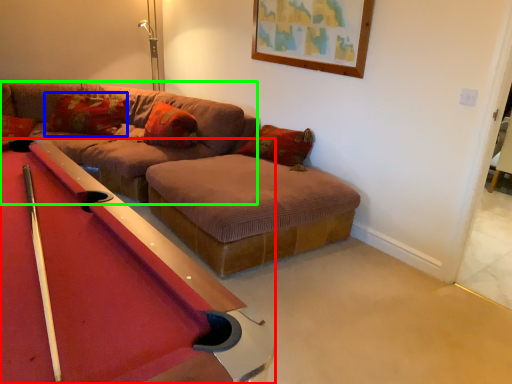
Question: Estimate the real-world distances between objects in this image. Which object is farther from billiard table (highlighted by a red box), pillow (highlighted by a blue box) or couch (highlighted by a green box)?

Choices:
 (A) pillow
 (B) couch

Answer: (A)